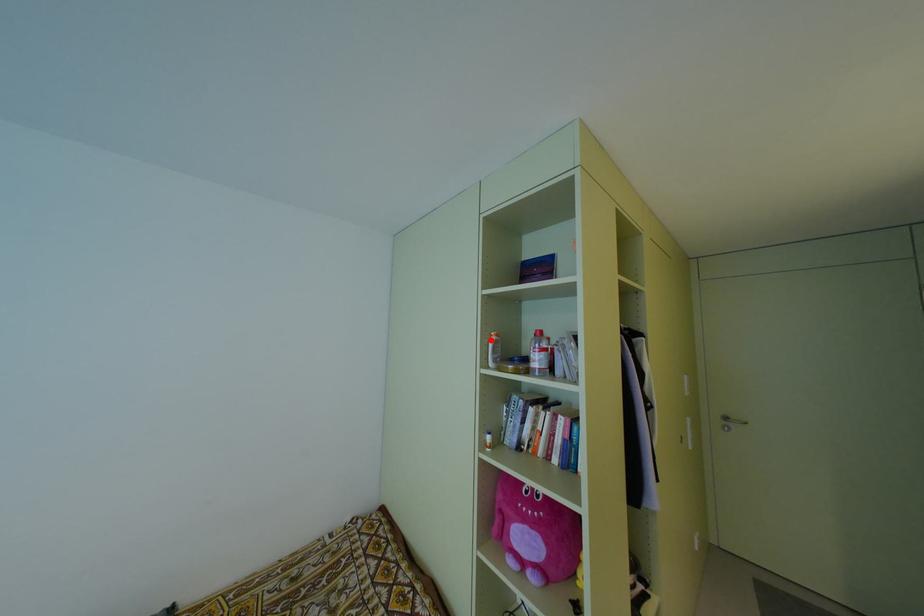
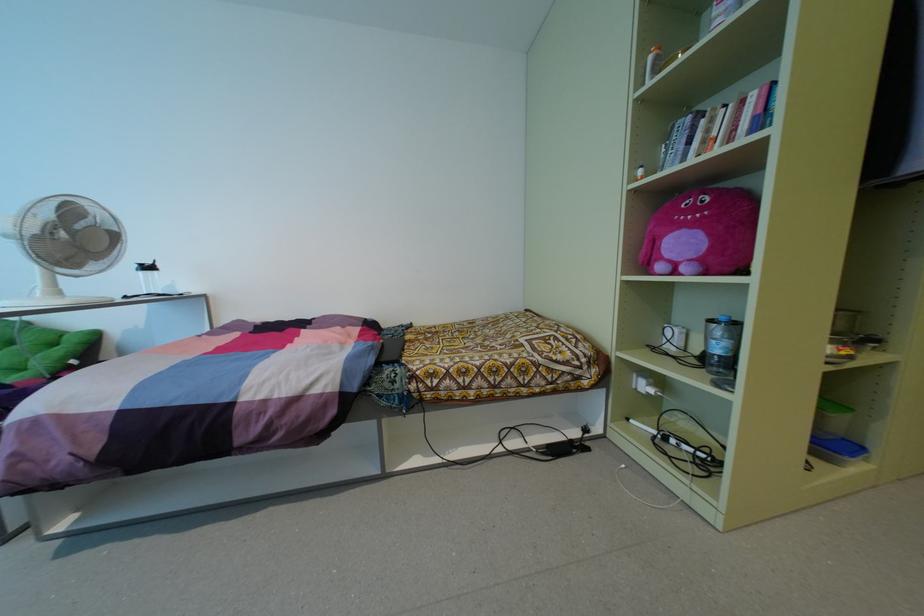
Question: I am providing you with two images of the same scene from different viewpoints. A red point is marked on the first image. At the location where the point appears in image 1, is it still visible in image 2?

Choices:
 (A) Yes
 (B) No

Answer: (A)